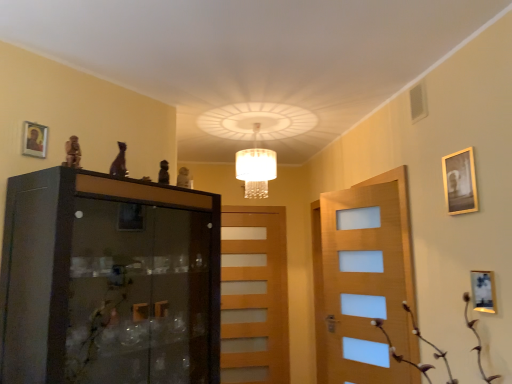
Question: Should I look upward or downward to see gold metallic picture frame at upper right, acting as the 2th picture frame starting from the left?

Choices:
 (A) down
 (B) up

Answer: (B)

Question: Does white crystal chandelier at center have a greater height compared to light brown wooden door at center?

Choices:
 (A) yes
 (B) no

Answer: (B)

Question: Is white crystal chandelier at center wider than light brown wooden door at center?

Choices:
 (A) yes
 (B) no

Answer: (A)

Question: Are white crystal chandelier at center and light brown wooden door at center far apart?

Choices:
 (A) no
 (B) yes

Answer: (B)

Question: Is white crystal chandelier at center to the left of light brown wooden door at center from the viewer's perspective?

Choices:
 (A) no
 (B) yes

Answer: (A)

Question: From a real-world perspective, is white crystal chandelier at center on light brown wooden door at center?

Choices:
 (A) yes
 (B) no

Answer: (A)

Question: Is light brown wooden door at center a part of white crystal chandelier at center?

Choices:
 (A) no
 (B) yes

Answer: (A)

Question: Can you confirm if gold metallic picture frame at upper right, acting as the 2th picture frame starting from the left, is bigger than brown textured plant at lower right?

Choices:
 (A) yes
 (B) no

Answer: (B)

Question: Can you confirm if gold metallic picture frame at upper right, the 2th picture frame positioned from the right, is taller than brown textured plant at lower right?

Choices:
 (A) no
 (B) yes

Answer: (A)

Question: From the image's perspective, is gold metallic picture frame at upper right, the 2th picture frame positioned from the right, on top of brown textured plant at lower right?

Choices:
 (A) yes
 (B) no

Answer: (A)

Question: Considering the relative sizes of gold metallic picture frame at upper right, the 2th picture frame positioned from the right, and brown textured plant at lower right in the image provided, is gold metallic picture frame at upper right, the 2th picture frame positioned from the right, shorter than brown textured plant at lower right?

Choices:
 (A) no
 (B) yes

Answer: (B)

Question: Could you tell me if gold metallic picture frame at upper right, the 2th picture frame when ordered from top to bottom, is turned towards brown textured plant at lower right?

Choices:
 (A) no
 (B) yes

Answer: (A)

Question: From the image's perspective, is gold metallic picture frame at upper right, the 2th picture frame when ordered from top to bottom, beneath brown textured plant at lower right?

Choices:
 (A) no
 (B) yes

Answer: (A)

Question: Considering the relative sizes of white crystal chandelier at center and brown textured plant at lower right in the image provided, is white crystal chandelier at center thinner than brown textured plant at lower right?

Choices:
 (A) no
 (B) yes

Answer: (B)